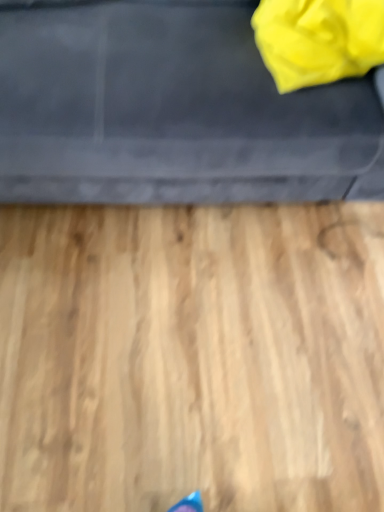
What is the approximate height of yellow fabric bag at upper right?

yellow fabric bag at upper right is 10.64 inches tall.

Describe the element at coordinates (318, 39) in the screenshot. The height and width of the screenshot is (512, 384). I see `yellow fabric bag at upper right` at that location.

What is the approximate width of yellow fabric bag at upper right?

yellow fabric bag at upper right is 17.99 inches in width.

The image size is (384, 512). What are the coordinates of `yellow fabric bag at upper right` in the screenshot? It's located at (318, 39).

Image resolution: width=384 pixels, height=512 pixels. In order to click on matte black sofa at upper center in this screenshot , I will do `click(171, 111)`.

What do you see at coordinates (171, 111) in the screenshot? I see `matte black sofa at upper center` at bounding box center [171, 111].

In order to click on yellow fabric bag at upper right in this screenshot , I will do coord(318,39).

Does yellow fabric bag at upper right appear on the right side of matte black sofa at upper center?

Indeed, yellow fabric bag at upper right is positioned on the right side of matte black sofa at upper center.

Is yellow fabric bag at upper right positioned in front of matte black sofa at upper center?

That is False.

Between point (325, 17) and point (183, 198), which one is positioned in front?

The point (325, 17) is in front.

Consider the image. From the image's perspective, is yellow fabric bag at upper right located above matte black sofa at upper center?

No.

Based on the photo, from a real-world perspective, relative to matte black sofa at upper center, is yellow fabric bag at upper right vertically above or below?

yellow fabric bag at upper right is above matte black sofa at upper center.

Between yellow fabric bag at upper right and matte black sofa at upper center, which one has larger width?

With larger width is matte black sofa at upper center.

In terms of height, does yellow fabric bag at upper right look taller or shorter compared to matte black sofa at upper center?

Considering their sizes, yellow fabric bag at upper right has less height than matte black sofa at upper center.

Is yellow fabric bag at upper right bigger or smaller than matte black sofa at upper center?

yellow fabric bag at upper right is smaller than matte black sofa at upper center.

Looking at this image, is yellow fabric bag at upper right inside the boundaries of matte black sofa at upper center, or outside?

yellow fabric bag at upper right is inside matte black sofa at upper center.

Is yellow fabric bag at upper right directly adjacent to matte black sofa at upper center?

No.

Could you tell me if yellow fabric bag at upper right is facing matte black sofa at upper center?

Yes, yellow fabric bag at upper right is oriented towards matte black sofa at upper center.

Can you tell me how much yellow fabric bag at upper right and matte black sofa at upper center differ in facing direction?

yellow fabric bag at upper right and matte black sofa at upper center are facing 0.603 degrees away from each other.

How distant is yellow fabric bag at upper right from matte black sofa at upper center?

yellow fabric bag at upper right is 9.89 inches from matte black sofa at upper center.

The image size is (384, 512). I want to click on bag that appears below the matte black sofa at upper center (from the image's perspective), so click(x=318, y=39).

Considering the relative positions of matte black sofa at upper center and yellow fabric bag at upper right in the image provided, is matte black sofa at upper center to the left of yellow fabric bag at upper right from the viewer's perspective?

Correct, you'll find matte black sofa at upper center to the left of yellow fabric bag at upper right.

Between matte black sofa at upper center and yellow fabric bag at upper right, which one is positioned in front?

Positioned in front is matte black sofa at upper center.

Considering the points (52, 164) and (328, 69), which point is in front, point (52, 164) or point (328, 69)?

Positioned in front is point (52, 164).

Looking at this image, from the image's perspective, is matte black sofa at upper center above or below yellow fabric bag at upper right?

Clearly, from the image's perspective, matte black sofa at upper center is above yellow fabric bag at upper right.

From a real-world perspective, who is located lower, matte black sofa at upper center or yellow fabric bag at upper right?

matte black sofa at upper center, from a real-world perspective.

Which of these two, matte black sofa at upper center or yellow fabric bag at upper right, is thinner?

With smaller width is yellow fabric bag at upper right.

Considering the sizes of matte black sofa at upper center and yellow fabric bag at upper right in the image, is matte black sofa at upper center taller or shorter than yellow fabric bag at upper right?

Considering their sizes, matte black sofa at upper center has more height than yellow fabric bag at upper right.

Is matte black sofa at upper center bigger or smaller than yellow fabric bag at upper right?

In the image, matte black sofa at upper center appears to be larger than yellow fabric bag at upper right.

Which is correct: matte black sofa at upper center is inside yellow fabric bag at upper right, or outside of it?

matte black sofa at upper center is spatially situated outside yellow fabric bag at upper right.

Is matte black sofa at upper center far away from yellow fabric bag at upper right?

No, matte black sofa at upper center is in close proximity to yellow fabric bag at upper right.

Is matte black sofa at upper center looking in the opposite direction of yellow fabric bag at upper right?

Correct, matte black sofa at upper center is looking away from yellow fabric bag at upper right.

What's the angular difference between matte black sofa at upper center and yellow fabric bag at upper right's facing directions?

The angular difference between matte black sofa at upper center and yellow fabric bag at upper right is 0.603 degrees.

Measure the distance between matte black sofa at upper center and yellow fabric bag at upper right.

matte black sofa at upper center and yellow fabric bag at upper right are 9.89 inches apart from each other.

Where is `furniture above the yellow fabric bag at upper right (from the image's perspective)`? furniture above the yellow fabric bag at upper right (from the image's perspective) is located at coordinates point(171,111).

The width and height of the screenshot is (384, 512). I want to click on furniture lying in front of the yellow fabric bag at upper right, so click(171, 111).

In order to click on bag below the matte black sofa at upper center (from the image's perspective) in this screenshot , I will do `click(318, 39)`.